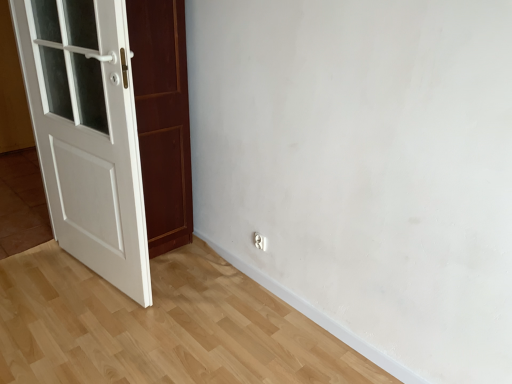
Question: Considering the positions of white glossy electric outlet at lower center and white wooden door at left in the image, is white glossy electric outlet at lower center taller or shorter than white wooden door at left?

Choices:
 (A) short
 (B) tall

Answer: (A)

Question: Which is correct: white glossy electric outlet at lower center is inside white wooden door at left, or outside of it?

Choices:
 (A) outside
 (B) inside

Answer: (A)

Question: From a real-world perspective, is white glossy electric outlet at lower center physically located above or below white wooden door at left?

Choices:
 (A) below
 (B) above

Answer: (A)

Question: From a real-world perspective, relative to white glossy electric outlet at lower center, is white wooden door at left vertically above or below?

Choices:
 (A) below
 (B) above

Answer: (B)

Question: Visually, is white wooden door at left positioned to the left or to the right of white glossy electric outlet at lower center?

Choices:
 (A) left
 (B) right

Answer: (A)

Question: In terms of height, does white wooden door at left look taller or shorter compared to white glossy electric outlet at lower center?

Choices:
 (A) short
 (B) tall

Answer: (B)

Question: Is white wooden door at left wider or thinner than white glossy electric outlet at lower center?

Choices:
 (A) thin
 (B) wide

Answer: (B)